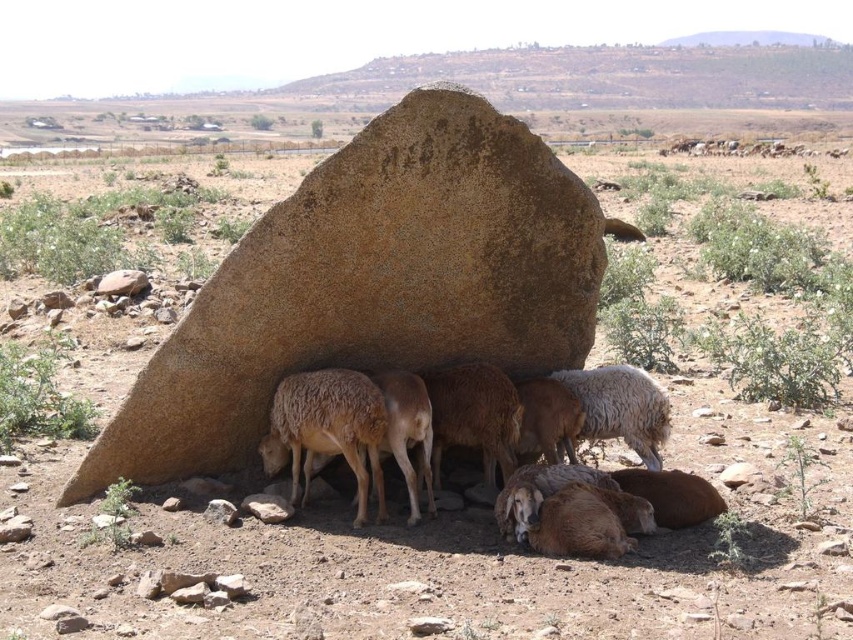
Question: Which point appears closest to the camera in this image?

Choices:
 (A) (326, 426)
 (B) (579, 314)
 (C) (583, 371)

Answer: (A)

Question: Does brown rough rock at center have a lesser width compared to fuzzy woolen sheep under rock?

Choices:
 (A) yes
 (B) no

Answer: (B)

Question: Can you confirm if fuzzy woolen sheep under rock is positioned to the left of white woolly sheep at center?

Choices:
 (A) no
 (B) yes

Answer: (B)

Question: Considering the real-world distances, which object is farthest from the brown rough rock at center?

Choices:
 (A) white woolly sheep at center
 (B) fuzzy woolen sheep under rock

Answer: (A)

Question: Does brown rough rock at center have a larger size compared to fuzzy woolen sheep under rock?

Choices:
 (A) yes
 (B) no

Answer: (A)

Question: Among these objects, which one is farthest from the camera?

Choices:
 (A) white woolly sheep at center
 (B) brown rough rock at center
 (C) fuzzy woolen sheep under rock

Answer: (A)